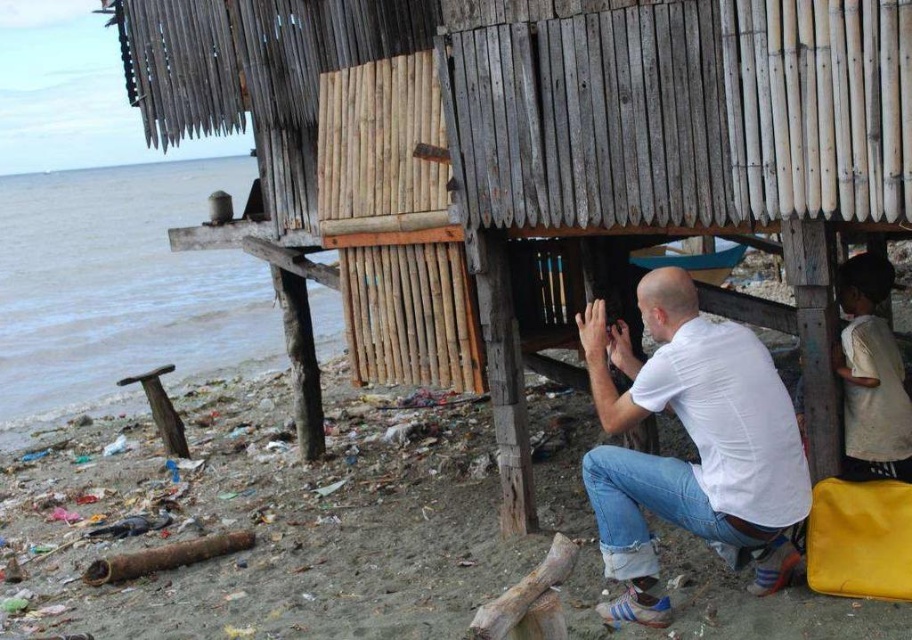
You are standing at the beach and want to take a photo of the man and the wooden hut. The camera can only focus on objects within a 0.2 unit distance from the camera. You have two points to choose from to place your tripod. The first point is at point (627,92) and the second is at point (125,330). Which point should you choose to ensure both the man and the wooden hut are in focus?

You should choose point (627,92) because it is closer to the camera than point (125,330), so both the man and the wooden hut will be within the 0.2 unit focus range.

You are standing at the beach and see the blue water at lower left and the white cotton shirt at lower right. Which object is closer to your left side?

The blue water at lower left is closer to your left side because it is positioned to the left of the white cotton shirt at lower right.

You are standing at the origin point of the coordinate system in the image. The origin is at the bottom left corner of the image. You want to walk to the wooden hut at center. In which direction should you move first?

Since the wooden hut at center is located at coordinate point 0.250 on the x axis and 0.598 on the y axis, you should first move to the right along the x axis towards 0.250 and then move upwards along the y axis towards 0.598 to reach the wooden hut at center.